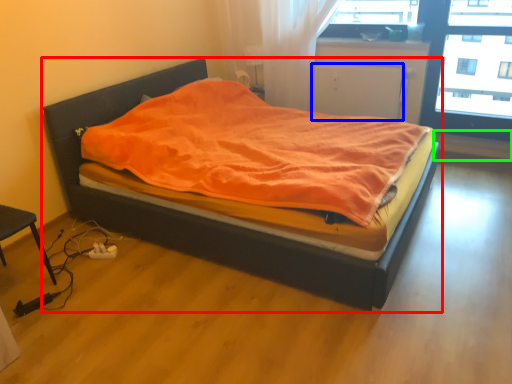
Question: Which object is the closest to the bed (highlighted by a red box)? Choose among these: screen door (highlighted by a blue box) or window sill (highlighted by a green box).

Choices:
 (A) screen door
 (B) window sill

Answer: (A)